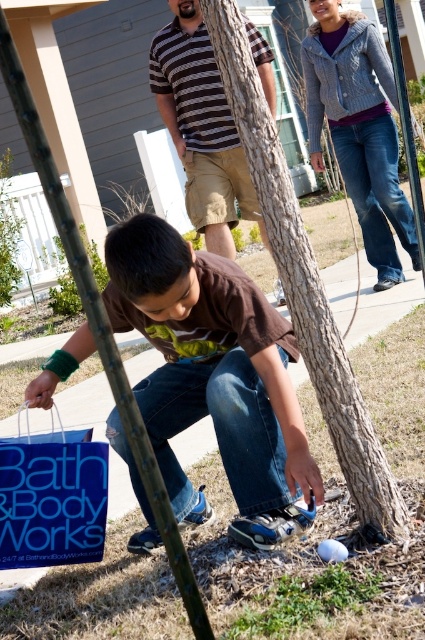
Between brown textured bark at center and striped cotton shirt at center, which one has less height?

brown textured bark at center

At what (x,y) coordinates should I click in order to perform the action: click on brown textured bark at center. Please return your answer as a coordinate pair (x, y). The height and width of the screenshot is (640, 425). Looking at the image, I should click on (303, 282).

Where is `brown textured bark at center`? brown textured bark at center is located at coordinates (303, 282).

Can you confirm if brown matte shirt at center is positioned to the right of striped cotton shirt at center?

Incorrect, brown matte shirt at center is not on the right side of striped cotton shirt at center.

Is point (243, 429) positioned behind point (201, 221)?

No, it is in front of (201, 221).

This screenshot has width=425, height=640. Describe the element at coordinates (214, 376) in the screenshot. I see `brown matte shirt at center` at that location.

Find the location of a particular element. brown matte shirt at center is located at coordinates (214, 376).

Does brown matte shirt at center come behind knitted gray sweater at upper right?

No, it is in front of knitted gray sweater at upper right.

Who is taller, brown matte shirt at center or knitted gray sweater at upper right?

Standing taller between the two is knitted gray sweater at upper right.

Which is behind, point (121, 332) or point (376, 288)?

The point (376, 288) is behind.

Find the location of `brown matte shirt at center`. brown matte shirt at center is located at coordinates (214, 376).